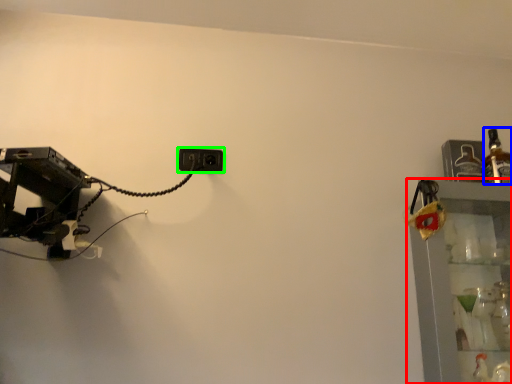
Question: Estimate the real-world distances between objects in this image. Which object is closer to shelf (highlighted by a red box), bottle (highlighted by a blue box) or power plugs and sockets (highlighted by a green box)?

Choices:
 (A) bottle
 (B) power plugs and sockets

Answer: (A)